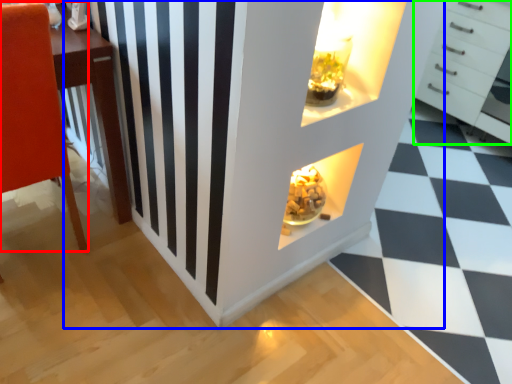
Question: Which object is positioned closest to furniture (highlighted by a red box)? Select from dresser (highlighted by a blue box) and chest of drawers (highlighted by a green box).

Choices:
 (A) dresser
 (B) chest of drawers

Answer: (A)